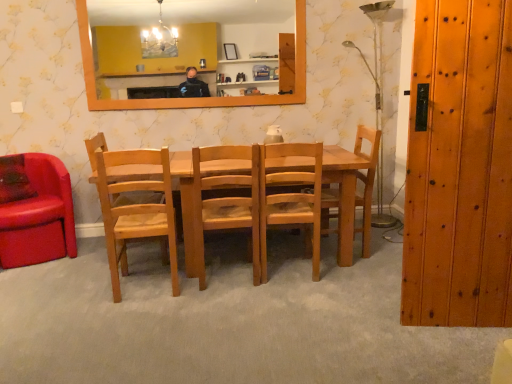
Question: Can you confirm if wooden door at right is smaller than leather couch at left, which ranks as the 5th chair in right-to-left order?

Choices:
 (A) yes
 (B) no

Answer: (A)

Question: Can you confirm if wooden door at right is positioned to the left of leather couch at left, which ranks as the 5th chair in right-to-left order?

Choices:
 (A) yes
 (B) no

Answer: (B)

Question: From a real-world perspective, is wooden door at right positioned over leather couch at left, acting as the first chair starting from the left, based on gravity?

Choices:
 (A) yes
 (B) no

Answer: (A)

Question: Can you confirm if wooden door at right is taller than leather couch at left, which ranks as the 5th chair in right-to-left order?

Choices:
 (A) yes
 (B) no

Answer: (A)

Question: Does wooden door at right lie in front of leather couch at left, acting as the first chair starting from the left?

Choices:
 (A) no
 (B) yes

Answer: (B)

Question: Is wooden chair at center, positioned as the fifth chair in left-to-right order, taller or shorter than orange wooden mirror at upper center?

Choices:
 (A) tall
 (B) short

Answer: (A)

Question: Is wooden chair at center, the first chair viewed from the right, inside or outside of orange wooden mirror at upper center?

Choices:
 (A) outside
 (B) inside

Answer: (A)

Question: Looking at the image, does wooden chair at center, positioned as the fifth chair in left-to-right order, seem bigger or smaller compared to orange wooden mirror at upper center?

Choices:
 (A) small
 (B) big

Answer: (B)

Question: From a real-world perspective, is wooden chair at center, the first chair viewed from the right, positioned above or below orange wooden mirror at upper center?

Choices:
 (A) above
 (B) below

Answer: (B)

Question: From a real-world perspective, is natural wood chair at left, the 2th chair from the left, positioned above or below wooden chair at center, positioned as the fifth chair in left-to-right order?

Choices:
 (A) above
 (B) below

Answer: (B)

Question: Relative to wooden chair at center, positioned as the fifth chair in left-to-right order, is natural wood chair at left, which is the 4th chair in right-to-left order, in front or behind?

Choices:
 (A) behind
 (B) front

Answer: (B)

Question: In terms of size, does natural wood chair at left, which is the 4th chair in right-to-left order, appear bigger or smaller than wooden chair at center, positioned as the fifth chair in left-to-right order?

Choices:
 (A) big
 (B) small

Answer: (A)

Question: Is point (164, 152) positioned closer to the camera than point (322, 233)?

Choices:
 (A) farther
 (B) closer

Answer: (B)

Question: In terms of height, does wooden chair at center, positioned as the fifth chair in left-to-right order, look taller or shorter compared to light brown wood chair at center, marked as the 4th chair in a left-to-right arrangement?

Choices:
 (A) tall
 (B) short

Answer: (A)

Question: Is wooden chair at center, positioned as the fifth chair in left-to-right order, to the left or to the right of light brown wood chair at center, marked as the 4th chair in a left-to-right arrangement, in the image?

Choices:
 (A) right
 (B) left

Answer: (A)